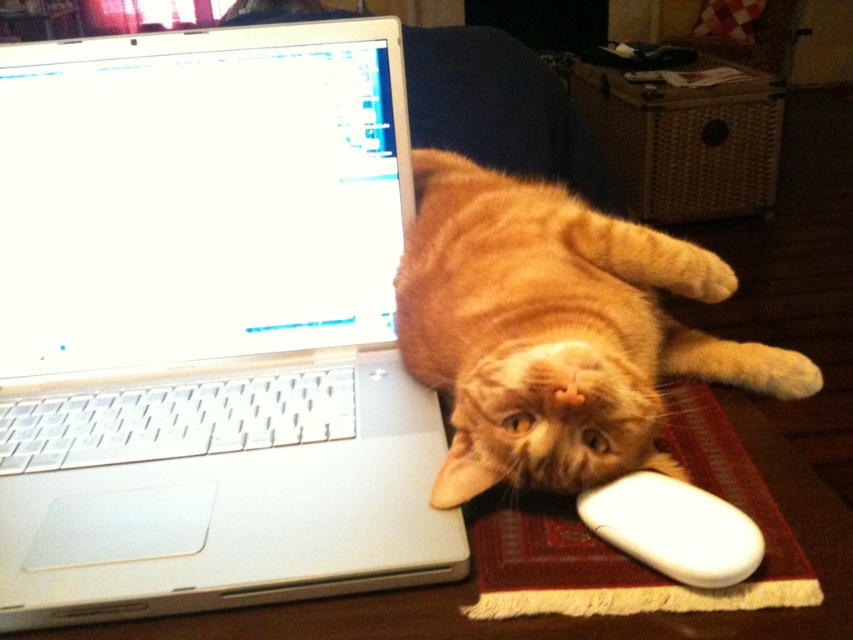
Question: Can you confirm if orange fur cat at center is bigger than white matte mouse at lower right?

Choices:
 (A) yes
 (B) no

Answer: (A)

Question: Which object is positioned farthest from the silver metallic laptop at upper left?

Choices:
 (A) orange fur cat at center
 (B) red woven mat at lower right
 (C) white matte mouse at lower right

Answer: (C)

Question: Among these points, which one is nearest to the camera?

Choices:
 (A) (666, 570)
 (B) (631, 419)

Answer: (A)

Question: Is silver metallic laptop at upper left closer to camera compared to orange fur cat at center?

Choices:
 (A) no
 (B) yes

Answer: (A)

Question: Estimate the real-world distances between objects in this image. Which object is farther from the white matte mouse at lower right?

Choices:
 (A) silver metallic laptop at upper left
 (B) red woven mat at lower right
 (C) orange fur cat at center

Answer: (A)

Question: Does orange fur cat at center lie behind white matte mouse at lower right?

Choices:
 (A) no
 (B) yes

Answer: (B)